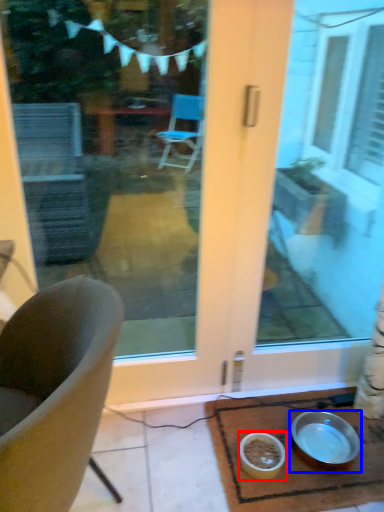
Question: Among these objects, which one is nearest to the camera, bowl (highlighted by a red box) or bowl (highlighted by a blue box)?

Choices:
 (A) bowl
 (B) bowl

Answer: (A)